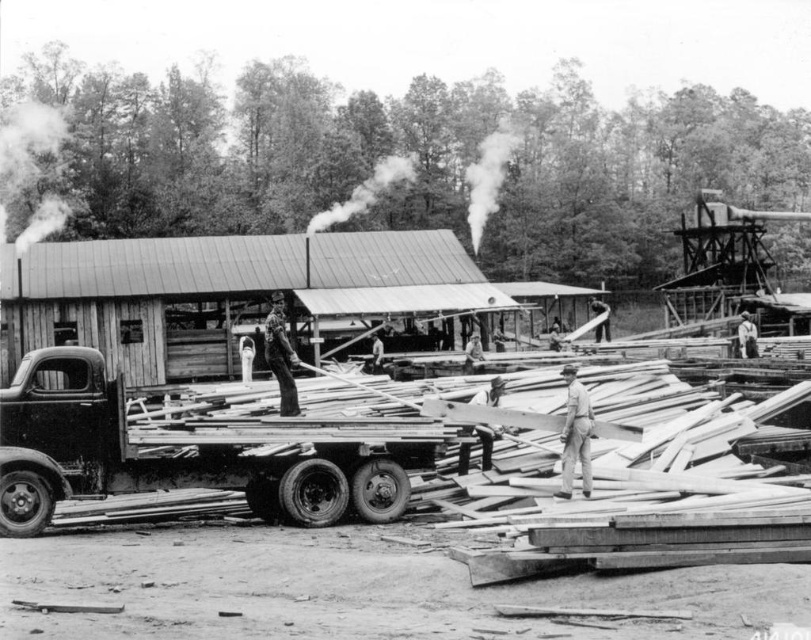
You are a worker in the lumberyard and need to move the smooth wood boards at center and the light brown wooden man at center to the storage area. Which object should you move first if you want to start with the one closer to the truck?

The smooth wood boards at center should be moved first because they are positioned to the left of the light brown wooden man at center, making them closer to the truck.

You are a carpenter assessing the materials on the truck. You need to determine which item is wider between the smooth wood boards at center and the wooden planks at center. Which one should you choose?

The smooth wood boards at center are wider than the wooden planks at center, so you should choose the smooth wood boards at center.

Looking at this image, you are standing in a lumberyard and want to load a heavy wooden beam onto the rusty metal trailer truck at center. If the beam is 3 meters long, can you safely lift and place it onto the truck without moving closer than your current position?

The rusty metal trailer truck at center is 36.21 meters away from the viewer. Since the beam is only 3 meters long, you cannot safely lift and place it onto the truck from that distance. You need to move closer to ensure safe handling.